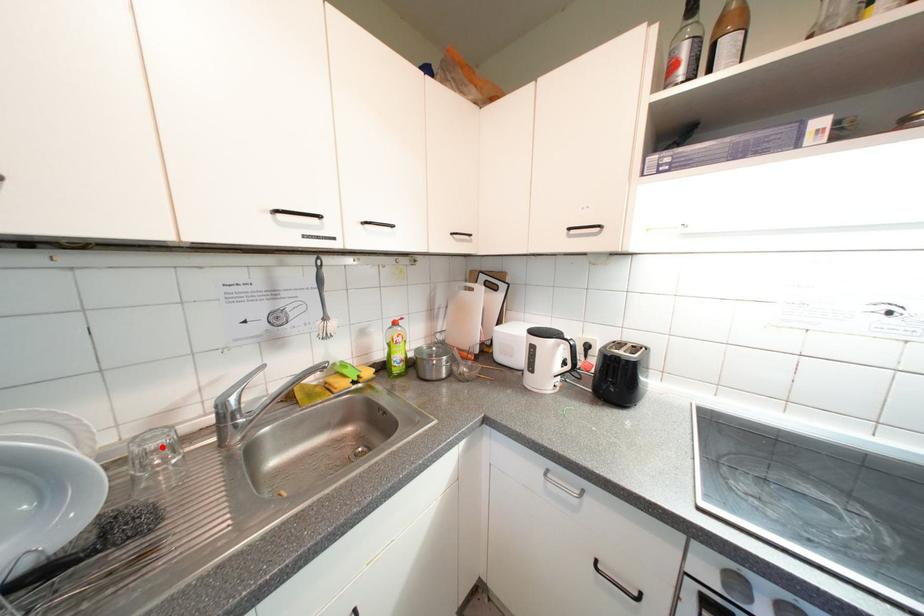
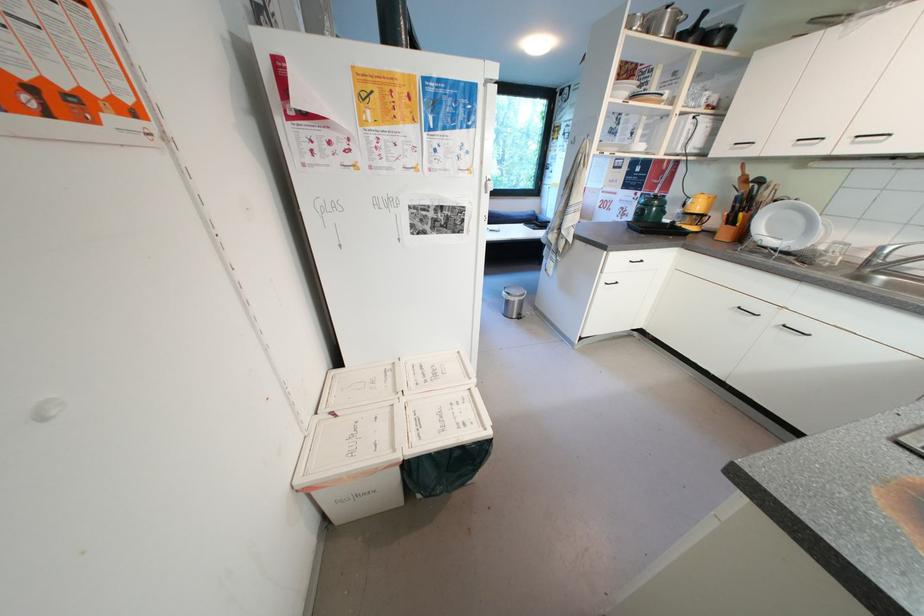
Question: A red point is marked in image1. In image2, is the corresponding 3D point closer to the camera or farther? Reply with the corresponding letter.

Choices:
 (A) The corresponding 3D point is closer.
 (B) The corresponding 3D point is farther.

Answer: (B)